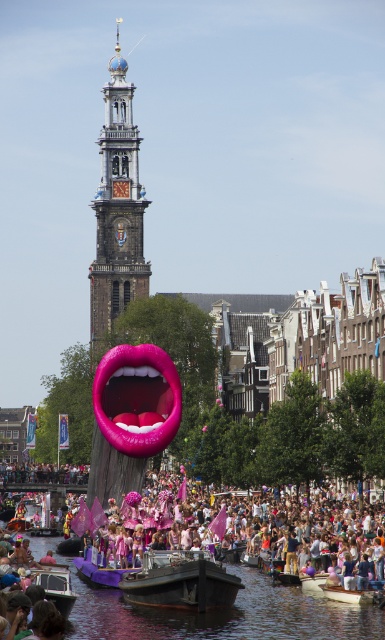
Does dark water at center appear under metallic silver boat at lower left?

Yes.

Which is below, dark water at center or metallic silver boat at lower left?

dark water at center is below.

What do you see at coordinates (224, 614) in the screenshot?
I see `dark water at center` at bounding box center [224, 614].

Find the location of a particular element. dark water at center is located at coordinates (224, 614).

Between pink matte/lipstick at center and wooden boat at lower center, which one is positioned lower?

wooden boat at lower center is lower down.

Is pink matte/lipstick at center thinner than wooden boat at lower center?

No, pink matte/lipstick at center is not thinner than wooden boat at lower center.

Locate an element on the screen. pink matte/lipstick at center is located at coordinates (137, 397).

Is dark water at center below purple fabric boat at center?

Correct, dark water at center is located below purple fabric boat at center.

Who is positioned more to the right, dark water at center or purple fabric boat at center?

From the viewer's perspective, dark water at center appears more on the right side.

Who is more forward, (326, 628) or (102, 568)?

Point (326, 628) is more forward.

Locate an element on the screen. This screenshot has height=640, width=385. dark water at center is located at coordinates (224, 614).